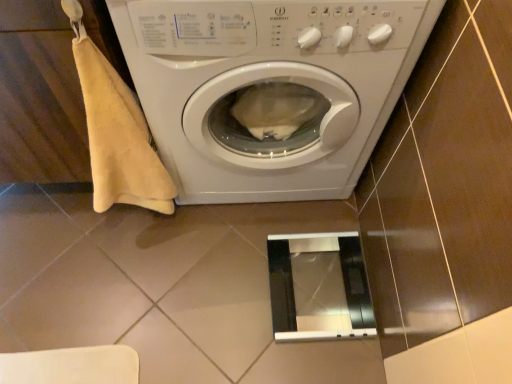
The image size is (512, 384). Identify the location of blank area beneath metallic silver screen door at lower center (from a real-world perspective). (321, 284).